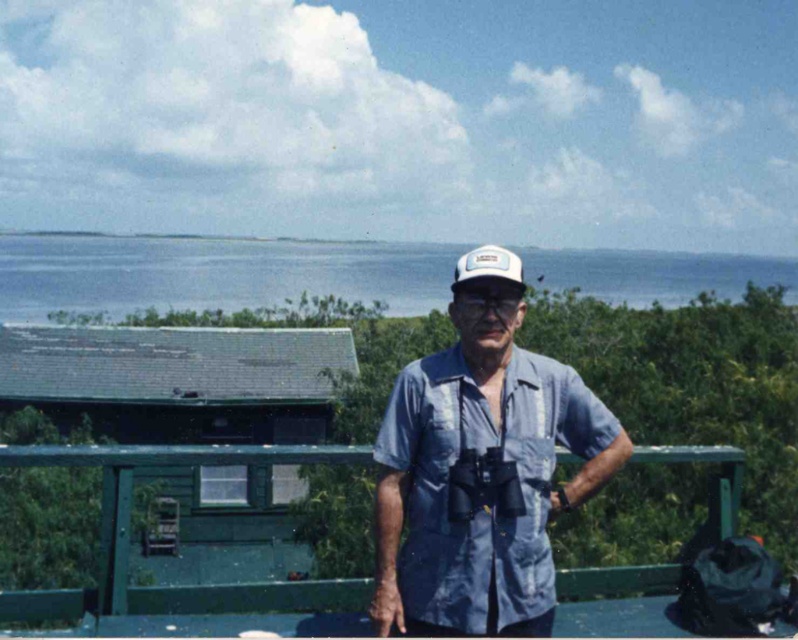
You are a painter who needs to paint the green painted wood at center and the white mesh cap at center. Which object requires more vertical space to accommodate its height?

The green painted wood at center requires more vertical space because it has a greater height compared to the white mesh cap at center.

You are a photographer positioned at the camera location. You want to capture a closeup shot of the blue denim shirt at center. What is the minimum distance you need to move towards the subject to achieve focus?

The blue denim shirt at center is 3.87 meters away from the camera. To capture a closeup shot, you need to move 3.87 meters closer to reduce the distance to the desired focus range.

You are a photographer trying to capture a wide shot of the blue water at upper center and the white mesh cap at center. Based on their relative sizes in the image, which object would appear larger in your photo?

The blue water at upper center might be wider than white mesh cap at center, so it would likely appear larger in the photo.